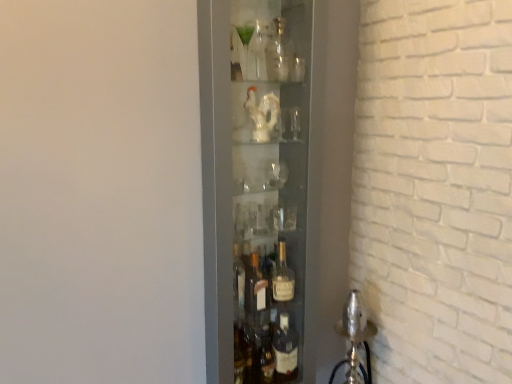
Question: Are clear glass bottle at upper center, acting as the 2th bottle starting from the back, and translucent glass bottle at center, which is the 1th bottle from bottom to top, located far from each other?

Choices:
 (A) no
 (B) yes

Answer: (A)

Question: From the image's perspective, is clear glass bottle at upper center, the second bottle positioned from the front, beneath translucent glass bottle at center, which is the 3th bottle in front-to-back order?

Choices:
 (A) yes
 (B) no

Answer: (B)

Question: From a real-world perspective, is clear glass bottle at upper center, the 1th bottle when ordered from top to bottom, physically above translucent glass bottle at center, which is the 1th bottle from bottom to top?

Choices:
 (A) yes
 (B) no

Answer: (A)

Question: Is clear glass bottle at upper center, the 1th bottle when ordered from top to bottom, next to translucent glass bottle at center, which is the 1th bottle from bottom to top?

Choices:
 (A) no
 (B) yes

Answer: (A)

Question: From the image's perspective, is clear glass bottle at upper center, the second bottle positioned from the front, on translucent glass bottle at center, the 3th bottle positioned from the top?

Choices:
 (A) no
 (B) yes

Answer: (B)

Question: In terms of height, does translucent glass bottle at center, acting as the first bottle starting from the back, look taller or shorter compared to transparent glass bottles at center?

Choices:
 (A) tall
 (B) short

Answer: (B)

Question: Relative to transparent glass bottles at center, is translucent glass bottle at center, which is the 1th bottle from bottom to top, in front or behind?

Choices:
 (A) behind
 (B) front

Answer: (A)

Question: In terms of width, does translucent glass bottle at center, the 3th bottle positioned from the top, look wider or thinner when compared to transparent glass bottles at center?

Choices:
 (A) thin
 (B) wide

Answer: (A)

Question: Visually, is translucent glass bottle at center, acting as the first bottle starting from the back, positioned to the left or to the right of transparent glass bottles at center?

Choices:
 (A) left
 (B) right

Answer: (B)

Question: Choose the correct answer: Is clear glass bottle at center, which is counted as the third bottle, starting from the back, inside transparent glass bottles at center or outside it?

Choices:
 (A) inside
 (B) outside

Answer: (A)

Question: In terms of height, does clear glass bottle at center, which is the second bottle from bottom to top, look taller or shorter compared to transparent glass bottles at center?

Choices:
 (A) short
 (B) tall

Answer: (A)

Question: Is clear glass bottle at center, which is the second bottle from bottom to top, in front of or behind transparent glass bottles at center in the image?

Choices:
 (A) behind
 (B) front

Answer: (A)

Question: Would you say clear glass bottle at center, which is the second bottle from bottom to top, is to the left or to the right of transparent glass bottles at center in the picture?

Choices:
 (A) left
 (B) right

Answer: (B)

Question: Considering the relative positions of clear glass bottle at upper center, the 1th bottle when ordered from top to bottom, and translucent glass bottle at center, acting as the first bottle starting from the back, in the image provided, is clear glass bottle at upper center, the 1th bottle when ordered from top to bottom, to the left or to the right of translucent glass bottle at center, acting as the first bottle starting from the back,?

Choices:
 (A) left
 (B) right

Answer: (A)

Question: Considering the positions of point (287, 56) and point (278, 288), is point (287, 56) closer or farther from the camera than point (278, 288)?

Choices:
 (A) farther
 (B) closer

Answer: (B)